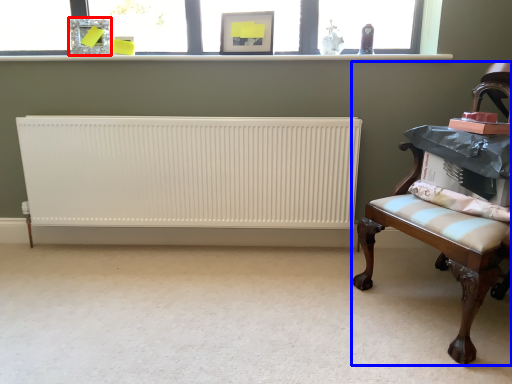
Question: Which of the following is the farthest to the observer, picture frame (highlighted by a red box) or furniture (highlighted by a blue box)?

Choices:
 (A) picture frame
 (B) furniture

Answer: (A)